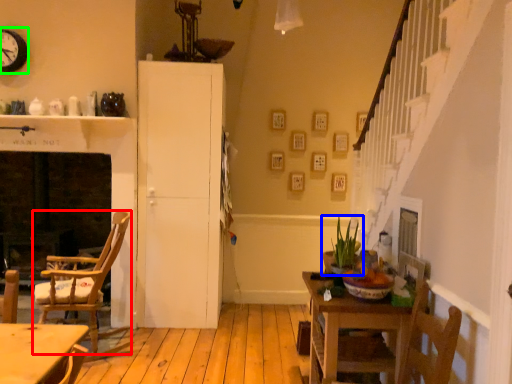
Question: Which object is the farthest from chair (highlighted by a red box)? Choose among these: houseplant (highlighted by a blue box) or clock (highlighted by a green box).

Choices:
 (A) houseplant
 (B) clock

Answer: (A)